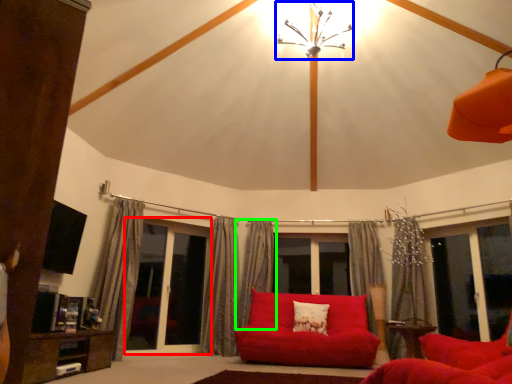
Question: Estimate the real-world distances between objects in this image. Which object is closer to screen door (highlighted by a red box), light fixture (highlighted by a blue box) or curtain (highlighted by a green box)?

Choices:
 (A) light fixture
 (B) curtain

Answer: (B)